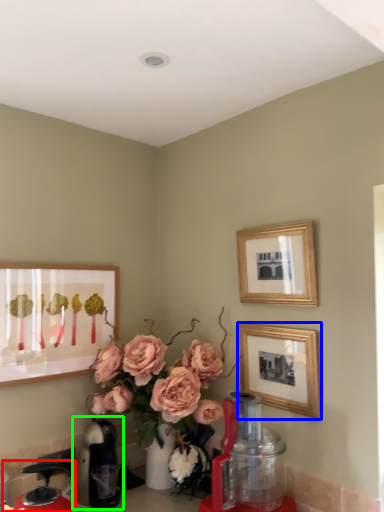
Question: Which object is the farthest from coffeepot (highlighted by a red box)? Choose among these: picture frame (highlighted by a blue box) or coffeepot (highlighted by a green box).

Choices:
 (A) picture frame
 (B) coffeepot

Answer: (A)